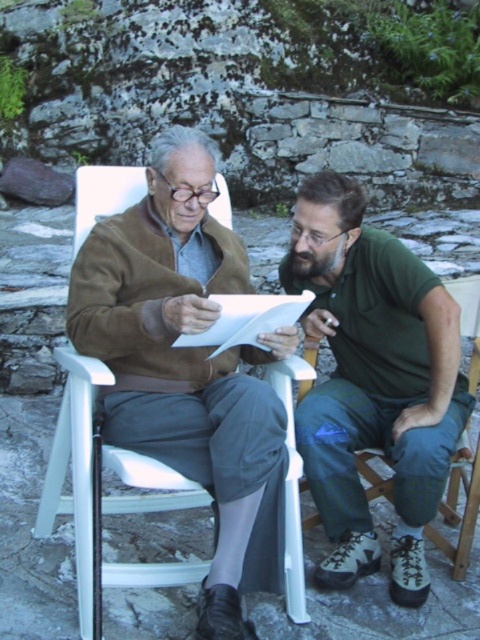
Question: Which point appears farthest from the camera in this image?

Choices:
 (A) [154, 566]
 (B) [422, 300]

Answer: (B)

Question: Among these objects, which one is farthest from the camera?

Choices:
 (A) green fabric shirt at right
 (B) white plastic chair at center

Answer: (A)

Question: Does green fabric shirt at right have a smaller size compared to white plastic chair at center?

Choices:
 (A) no
 (B) yes

Answer: (A)

Question: In this image, where is green fabric shirt at right located relative to white plastic chair at center?

Choices:
 (A) above
 (B) below

Answer: (A)

Question: Can you confirm if green fabric shirt at right is positioned above white plastic chair at center?

Choices:
 (A) no
 (B) yes

Answer: (B)